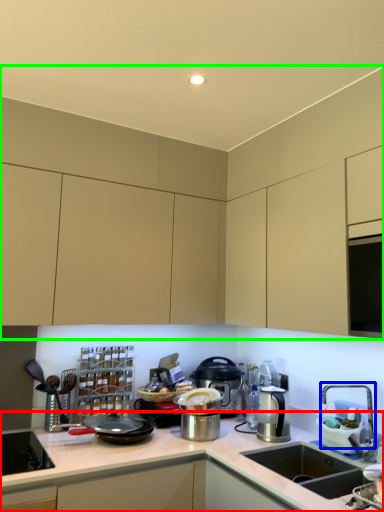
Question: Which is farther away from countertop (highlighted by a red box)? faucet (highlighted by a blue box) or cabinetry (highlighted by a green box)?

Choices:
 (A) faucet
 (B) cabinetry

Answer: (B)